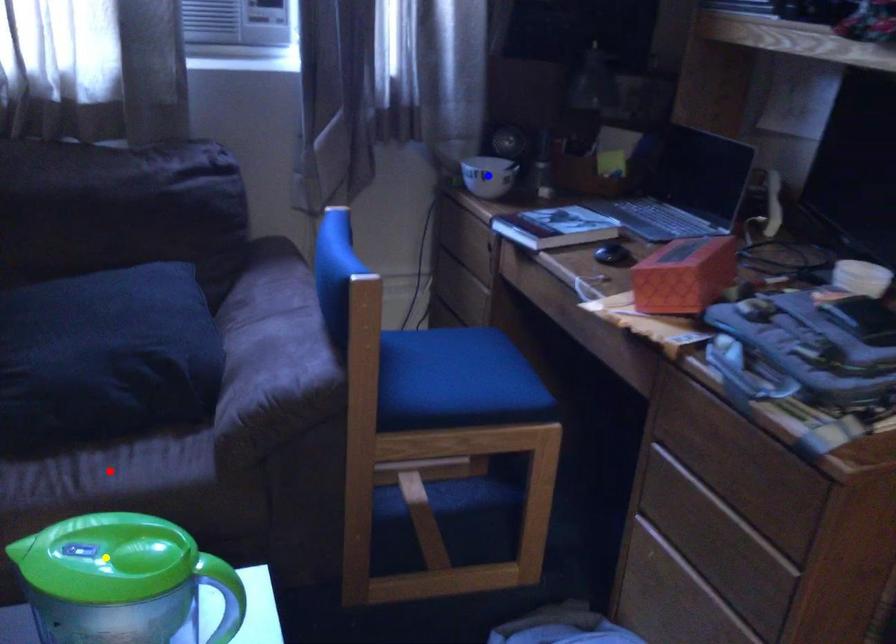
Order these from nearest to farthest:
- blue point
- red point
- yellow point

blue point < red point < yellow point